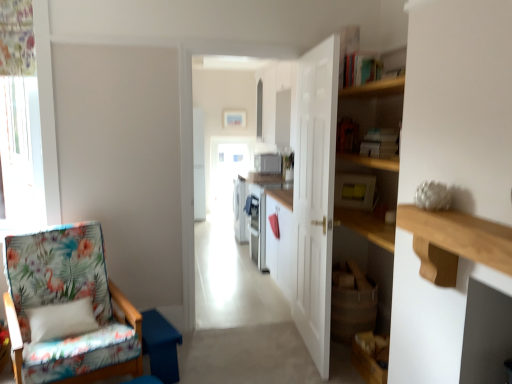
I want to click on vacant area to the left of white wooden door at center, so click(x=237, y=354).